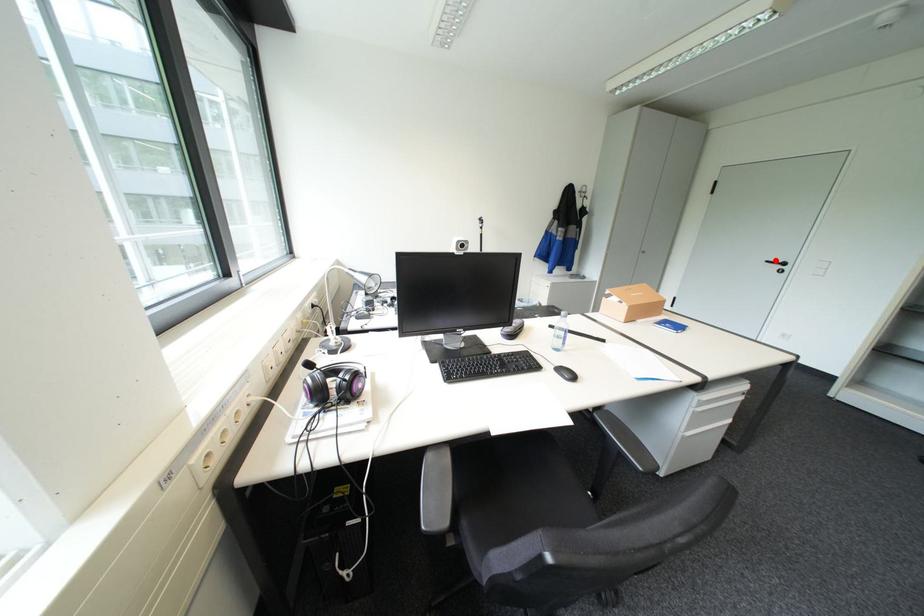
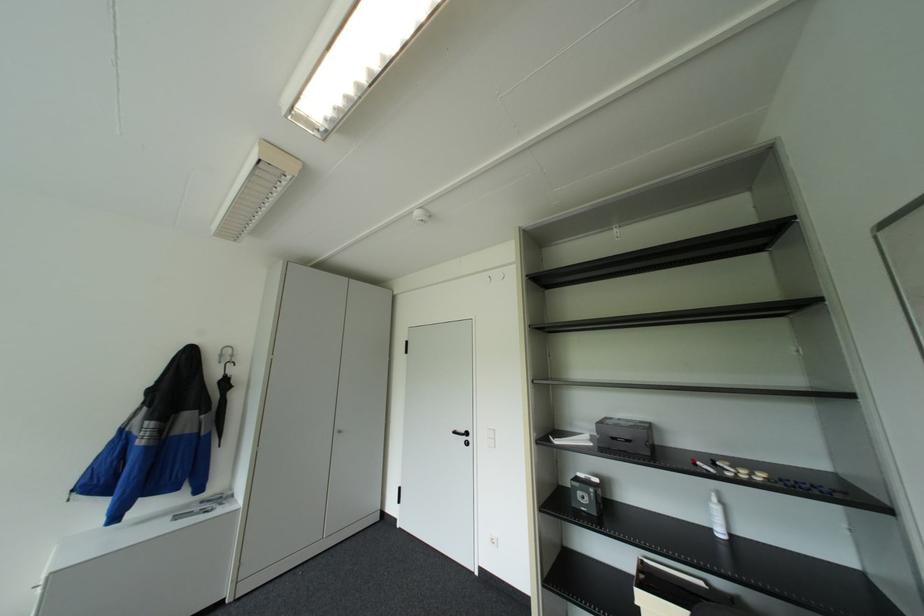
Locate, in the second image, the point that corresponds to the highlighted location in the first image.

(463, 431)